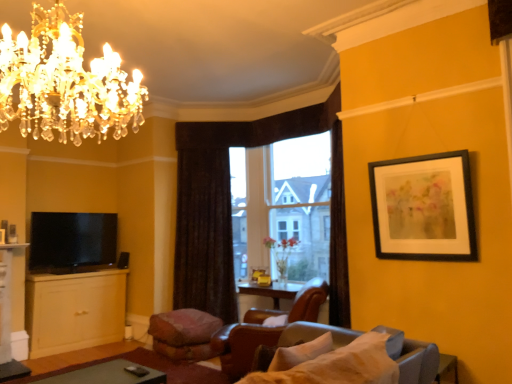
Question: Is matte yellow cabinet at lower left closer to camera compared to transparent glass window at center?

Choices:
 (A) yes
 (B) no

Answer: (A)

Question: From a real-world perspective, is matte yellow cabinet at lower left on transparent glass window at center?

Choices:
 (A) no
 (B) yes

Answer: (A)

Question: From the image's perspective, is matte yellow cabinet at lower left located beneath transparent glass window at center?

Choices:
 (A) yes
 (B) no

Answer: (A)

Question: Is transparent glass window at center at the back of matte yellow cabinet at lower left?

Choices:
 (A) yes
 (B) no

Answer: (B)

Question: Is matte yellow cabinet at lower left shorter than transparent glass window at center?

Choices:
 (A) no
 (B) yes

Answer: (B)

Question: Is matte yellow cabinet at lower left further to the viewer compared to transparent glass window at center?

Choices:
 (A) no
 (B) yes

Answer: (A)

Question: Is green matte table at lower left at the right side of leather at center?

Choices:
 (A) yes
 (B) no

Answer: (B)

Question: From the image's perspective, is green matte table at lower left located above leather at center?

Choices:
 (A) yes
 (B) no

Answer: (A)

Question: Does green matte table at lower left have a smaller size compared to leather at center?

Choices:
 (A) yes
 (B) no

Answer: (A)

Question: Are green matte table at lower left and leather at center located far from each other?

Choices:
 (A) yes
 (B) no

Answer: (A)

Question: Considering the relative positions of green matte table at lower left and leather at center in the image provided, is green matte table at lower left in front of leather at center?

Choices:
 (A) yes
 (B) no

Answer: (A)

Question: From a real-world perspective, is green matte table at lower left over leather at center?

Choices:
 (A) no
 (B) yes

Answer: (A)

Question: Is dark brown textured curtain at center facing towards transparent glass window at center?

Choices:
 (A) yes
 (B) no

Answer: (B)